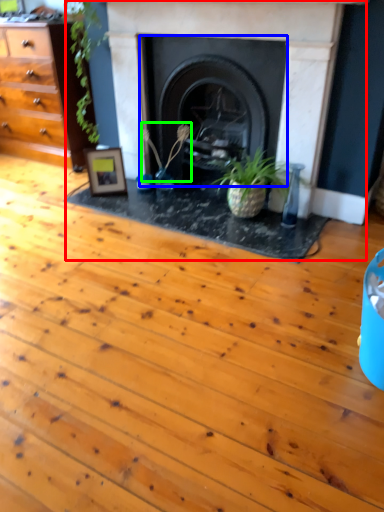
Question: Which is nearer to the fireplace (highlighted by a red box)? fireplace (highlighted by a blue box) or plant (highlighted by a green box).

Choices:
 (A) fireplace
 (B) plant

Answer: (A)